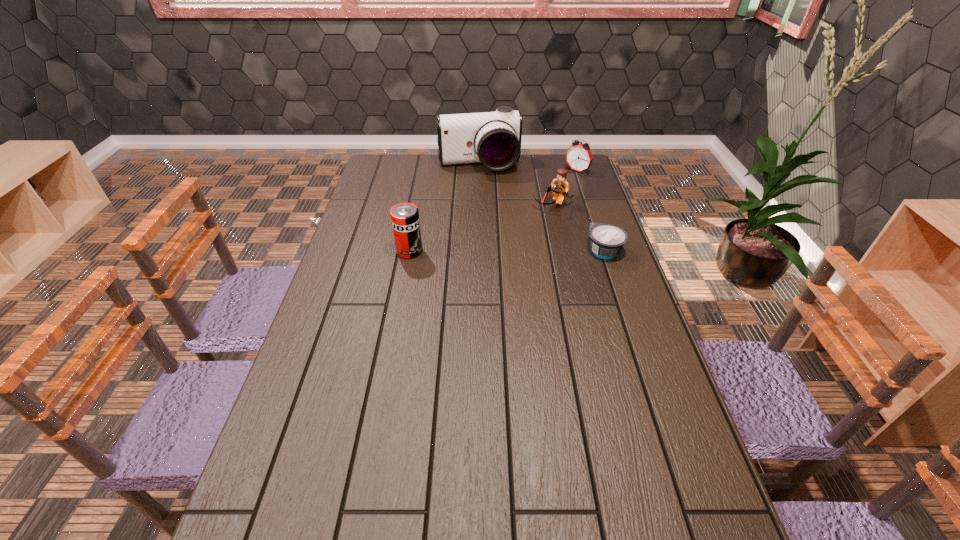
Where is `free space on the desktop that is between the leftmost object and the yogurt and is positioned holding a crossbow in the hands of the Lego`? free space on the desktop that is between the leftmost object and the yogurt and is positioned holding a crossbow in the hands of the Lego is located at coordinates pos(518,251).

Identify the location of vacant space on the desktop that is between the fourth shortest object and the yogurt and is positioned on the clock face of the alarm clock. The width and height of the screenshot is (960, 540). (479, 251).

Identify the location of free space on the desktop that is between the second tallest object and the shortest object and is positioned on the surface of the tallest object. Image resolution: width=960 pixels, height=540 pixels. (505, 251).